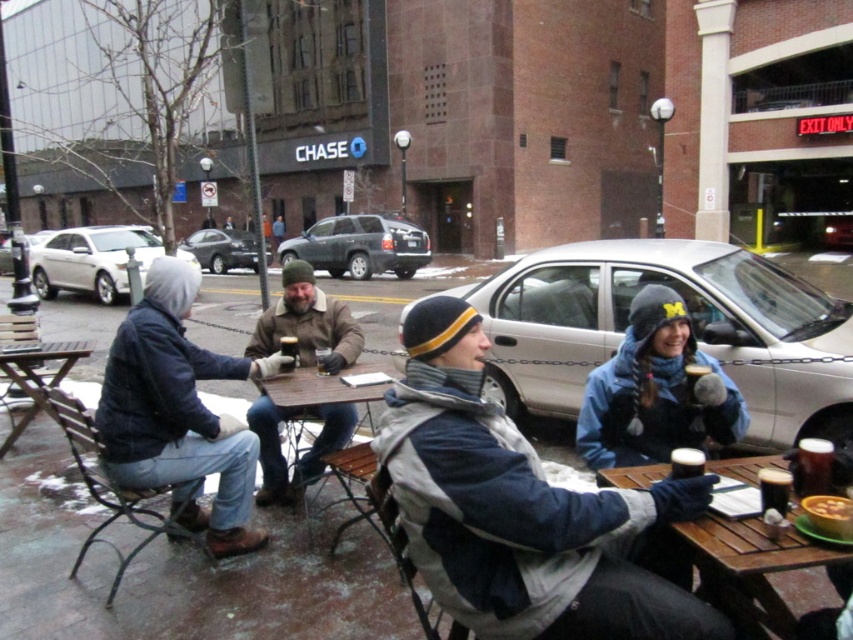
Question: Does dark brown glass at lower right have a greater width compared to translucent glass mug at lower right?

Choices:
 (A) no
 (B) yes

Answer: (B)

Question: Does wooden table at lower right appear on the left side of smooth yellow soup at lower right?

Choices:
 (A) no
 (B) yes

Answer: (B)

Question: Estimate the real-world distances between objects in this image. Which object is closer to the wooden table at left?

Choices:
 (A) wooden table at lower right
 (B) brown leather jacket at center
 (C) matte plastic cup at center

Answer: (B)

Question: Which of the following is the closest to the observer?

Choices:
 (A) (816, 467)
 (B) (107, 256)
 (C) (698, 465)

Answer: (A)

Question: Can you confirm if wooden table at lower right is smaller than wooden table at center?

Choices:
 (A) no
 (B) yes

Answer: (A)

Question: Which is nearer to the silver metallic sedan at right?

Choices:
 (A) denim jacket at left
 (B) brown leather jacket at center

Answer: (A)